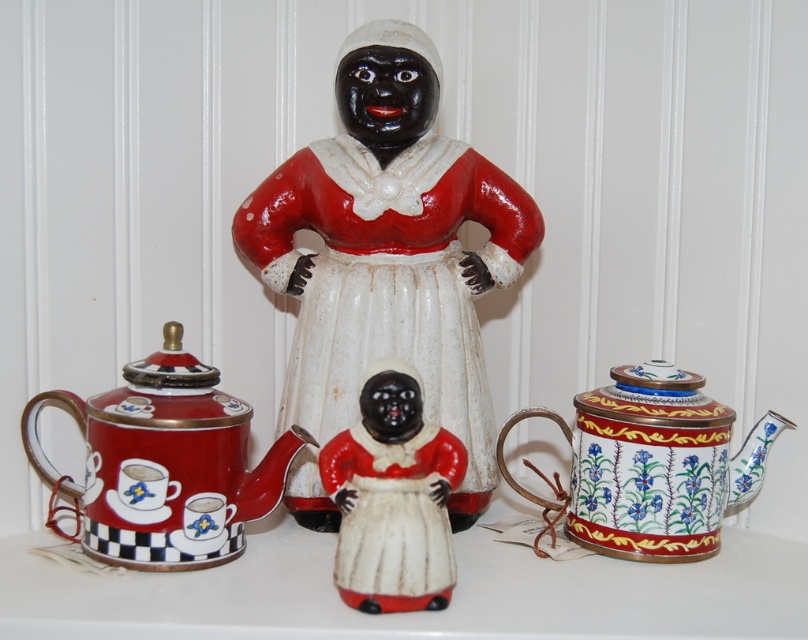
Question: Can you confirm if matte red teapot at left is positioned to the right of matte porcelain doll at center?

Choices:
 (A) no
 (B) yes

Answer: (A)

Question: Which point is farther from the camera taking this photo?

Choices:
 (A) (128, 465)
 (B) (726, 486)

Answer: (B)

Question: Is matte ceramic figure at center above enamel floral teapot at right?

Choices:
 (A) no
 (B) yes

Answer: (B)

Question: Which object is farther from the camera taking this photo?

Choices:
 (A) matte red teapot at left
 (B) enamel floral teapot at right
 (C) matte ceramic figure at center

Answer: (C)

Question: Among these objects, which one is farthest from the camera?

Choices:
 (A) matte porcelain doll at center
 (B) matte red teapot at left
 (C) matte ceramic figure at center
 (D) enamel floral teapot at right

Answer: (C)

Question: Does matte ceramic figure at center lie behind matte red teapot at left?

Choices:
 (A) no
 (B) yes

Answer: (B)